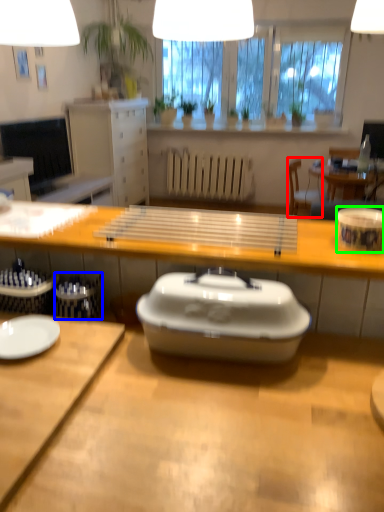
Question: Considering the real-world distances, which object is closest to chair (highlighted by a red box)? trash bin/can (highlighted by a blue box) or tableware (highlighted by a green box).

Choices:
 (A) trash bin/can
 (B) tableware

Answer: (B)